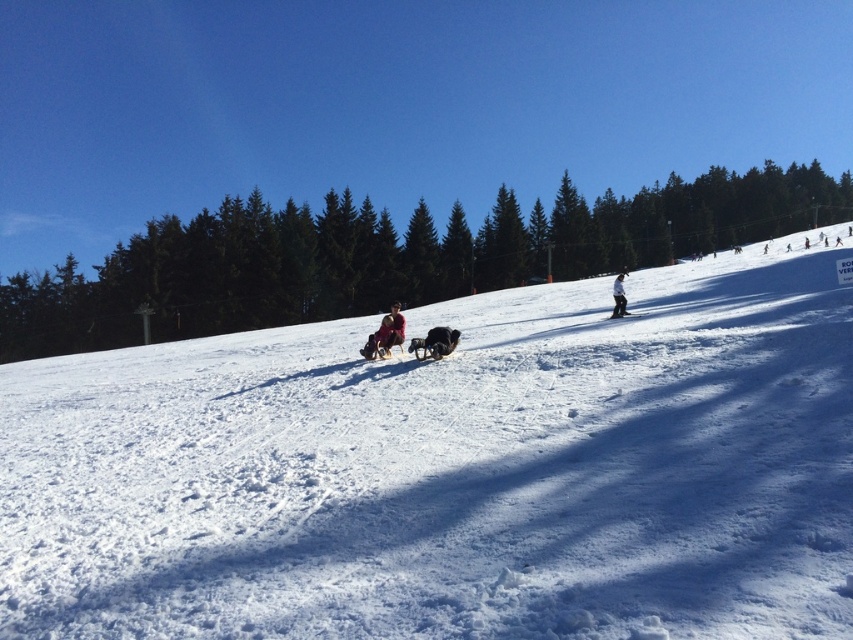
You are standing at the top of the snowy slope and want to place two flags at the coordinates point (631, 444) and point (624, 310). Which flag will be closer to your current position?

Point (631, 444) is closer to the camera than point (624, 310), so the flag placed at point (631, 444) will be closer to your current position.

You are standing at the bottom of the slope and want to estimate how far the red fabric sled at center is from you. Based on the scene, what is the approximate distance in feet?

The red fabric sled at center is approximately 90.74 feet away from the viewer.

You are planning to build a snowman using the white fluffy snow at center and want to place the white snowboarder at center nearby for a photo. Is there enough space between them to ensure the snowboarder doesn t block the snowman in the picture?

The distance between the white fluffy snow at center and the white snowboarder at center is 17.72 meters, which is sufficient space to position the snowboarder without blocking the snowman in the photo.